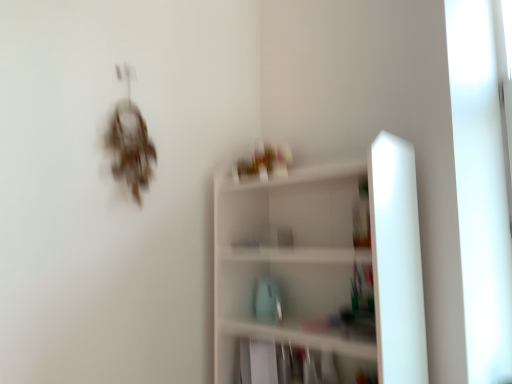
What do you see at coordinates (324, 269) in the screenshot? The width and height of the screenshot is (512, 384). I see `white matte shelf at center` at bounding box center [324, 269].

This screenshot has height=384, width=512. I want to click on white matte shelf at center, so click(x=324, y=269).

Locate an element on the screen. white matte shelf at center is located at coordinates (324, 269).